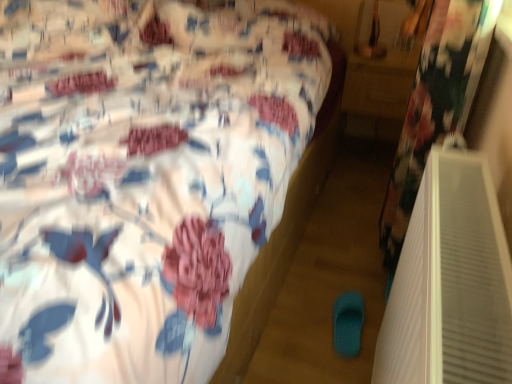
Image resolution: width=512 pixels, height=384 pixels. Describe the element at coordinates (348, 323) in the screenshot. I see `teal rubber slipper at lower center` at that location.

Identify the location of floral fabric bed at center. The width and height of the screenshot is (512, 384). (144, 178).

The image size is (512, 384). Identify the location of wooden table at right. (378, 93).

Can you confirm if floral fabric bed at center is bigger than teal rubber slipper at lower center?

Yes.

From a real-world perspective, is floral fabric bed at center physically located above or below teal rubber slipper at lower center?

From a real-world perspective, floral fabric bed at center is physically above teal rubber slipper at lower center.

Would you say floral fabric bed at center is a long distance from teal rubber slipper at lower center?

No.

Which of these two, teal rubber slipper at lower center or wooden table at right, is smaller?

With smaller size is teal rubber slipper at lower center.

From the picture: Measure the distance from teal rubber slipper at lower center to wooden table at right.

They are 3.37 feet apart.

Considering the relative sizes of teal rubber slipper at lower center and wooden table at right in the image provided, is teal rubber slipper at lower center wider than wooden table at right?

No, teal rubber slipper at lower center is not wider than wooden table at right.

At what (x,y) coordinates should I click in order to perform the action: click on table to the right of teal rubber slipper at lower center. Please return your answer as a coordinate pair (x, y). The width and height of the screenshot is (512, 384). Looking at the image, I should click on (378, 93).

Considering the relative sizes of teal rubber slipper at lower center and floral fabric bed at center in the image provided, is teal rubber slipper at lower center taller than floral fabric bed at center?

No.

Is teal rubber slipper at lower center located outside floral fabric bed at center?

Yes, teal rubber slipper at lower center is located beyond the bounds of floral fabric bed at center.

From a real-world perspective, is teal rubber slipper at lower center positioned above or below floral fabric bed at center?

teal rubber slipper at lower center is situated lower than floral fabric bed at center in the real world.

Visually, is teal rubber slipper at lower center positioned to the left or to the right of floral fabric bed at center?

teal rubber slipper at lower center is to the right of floral fabric bed at center.

From the image's perspective, between wooden table at right and floral fabric bed at center, which one is located above?

wooden table at right.

Locate an element on the screen. The height and width of the screenshot is (384, 512). bed above the wooden table at right (from a real-world perspective) is located at coordinates (144, 178).

Is wooden table at right positioned behind floral fabric bed at center?

Yes, it is.

From the image's perspective, is floral fabric bed at center under wooden table at right?

Correct, floral fabric bed at center appears lower than wooden table at right in the image.

From a real-world perspective, is floral fabric bed at center under wooden table at right?

Actually, floral fabric bed at center is physically above wooden table at right in the real world.

Between floral fabric bed at center and wooden table at right, which one has larger width?

Wider between the two is floral fabric bed at center.

What's the angular difference between floral fabric bed at center and wooden table at right's facing directions?

floral fabric bed at center and wooden table at right are facing 0.127 degrees away from each other.

From a real-world perspective, between wooden table at right and teal rubber slipper at lower center, who is vertically lower?

In real-world perspective, teal rubber slipper at lower center is lower.

Does wooden table at right have a smaller size compared to teal rubber slipper at lower center?

Actually, wooden table at right might be larger than teal rubber slipper at lower center.

Which of these two, wooden table at right or teal rubber slipper at lower center, is wider?

wooden table at right.

From the image's perspective, which is below, wooden table at right or teal rubber slipper at lower center?

teal rubber slipper at lower center is shown below in the image.

This screenshot has width=512, height=384. I want to click on slipper that is below the floral fabric bed at center (from the image's perspective), so click(x=348, y=323).

Locate an element on the screen. The image size is (512, 384). table on the right of teal rubber slipper at lower center is located at coordinates (378, 93).

Looking at the image, which one is located further to teal rubber slipper at lower center, wooden table at right or floral fabric bed at center?

The object further to teal rubber slipper at lower center is wooden table at right.

Considering their positions, is teal rubber slipper at lower center positioned further to wooden table at right than floral fabric bed at center?

teal rubber slipper at lower center is further to wooden table at right.

From the image, which object appears to be nearer to teal rubber slipper at lower center, floral fabric bed at center or wooden table at right?

The object closer to teal rubber slipper at lower center is floral fabric bed at center.

When comparing their distances from floral fabric bed at center, does teal rubber slipper at lower center or wooden table at right seem further?

Among the two, wooden table at right is located further to floral fabric bed at center.

From the image, which object appears to be farther from floral fabric bed at center, wooden table at right or teal rubber slipper at lower center?

wooden table at right lies further to floral fabric bed at center than the other object.

From the image, which object appears to be nearer to wooden table at right, floral fabric bed at center or teal rubber slipper at lower center?

The object closer to wooden table at right is floral fabric bed at center.

The image size is (512, 384). I want to click on slipper located between floral fabric bed at center and wooden table at right in the depth direction, so click(348, 323).